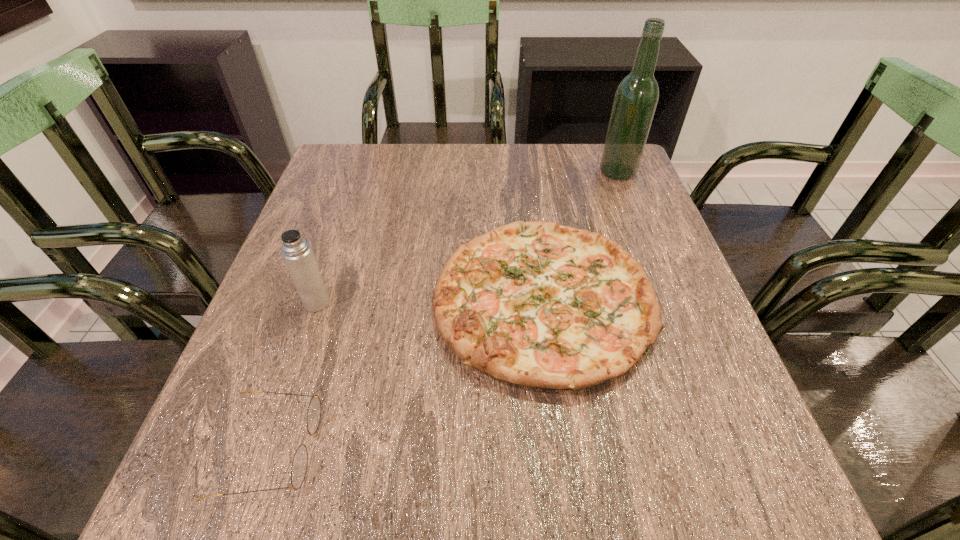
The image size is (960, 540). Find the location of `free region at the right edge of the desktop`. free region at the right edge of the desktop is located at coordinates (701, 424).

Find the location of `vacant position at the far left corner of the desktop`. vacant position at the far left corner of the desktop is located at coordinates pyautogui.click(x=376, y=185).

This screenshot has width=960, height=540. In order to click on free location at the near left corner in this screenshot , I will do `click(234, 481)`.

Identify the location of blank space at the far right corner. (596, 150).

At what (x,y) coordinates should I click in order to perform the action: click on vacant region at the near right corner of the desktop. Please return your answer as a coordinate pair (x, y). Looking at the image, I should click on (744, 476).

You are a GUI agent. You are given a task and a screenshot of the screen. Output one action in this format:
    pyautogui.click(x=<x>, y=<y>)
    Task: Click on the free point between the pizza and the spectacles
    The height and width of the screenshot is (540, 960).
    Given the screenshot: What is the action you would take?
    pyautogui.click(x=407, y=374)

Identify the location of free space between the second tallest object and the spectacles. pos(294,375).

At what (x,y) coordinates should I click in order to perform the action: click on vacant point located between the nearest object and the third shortest object. Please return your answer as a coordinate pair (x, y). Looking at the image, I should click on [294, 375].

Locate an element on the screen. This screenshot has height=540, width=960. unoccupied position between the third shortest object and the pizza is located at coordinates (429, 301).

Locate an element on the screen. The width and height of the screenshot is (960, 540). free space between the nearest object and the pizza is located at coordinates (407, 374).